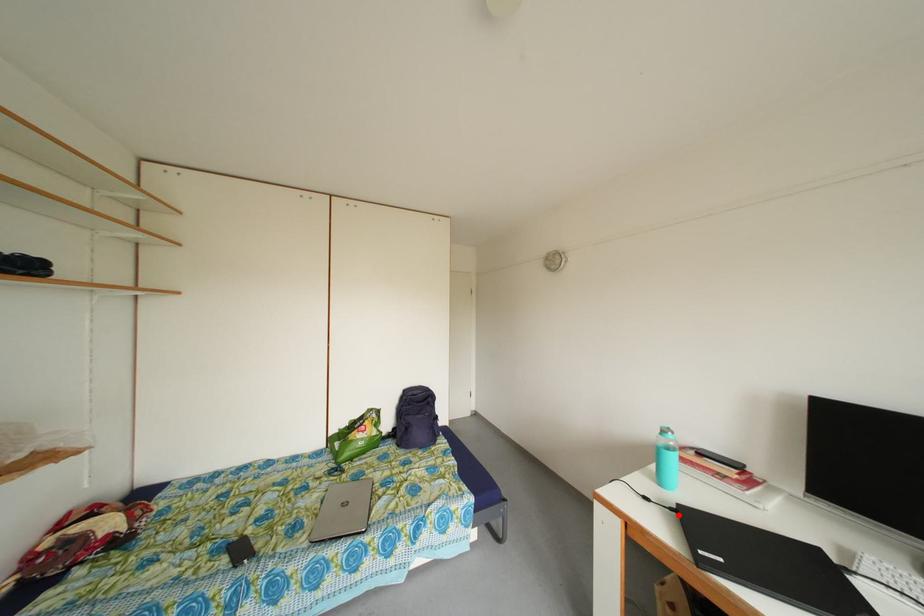
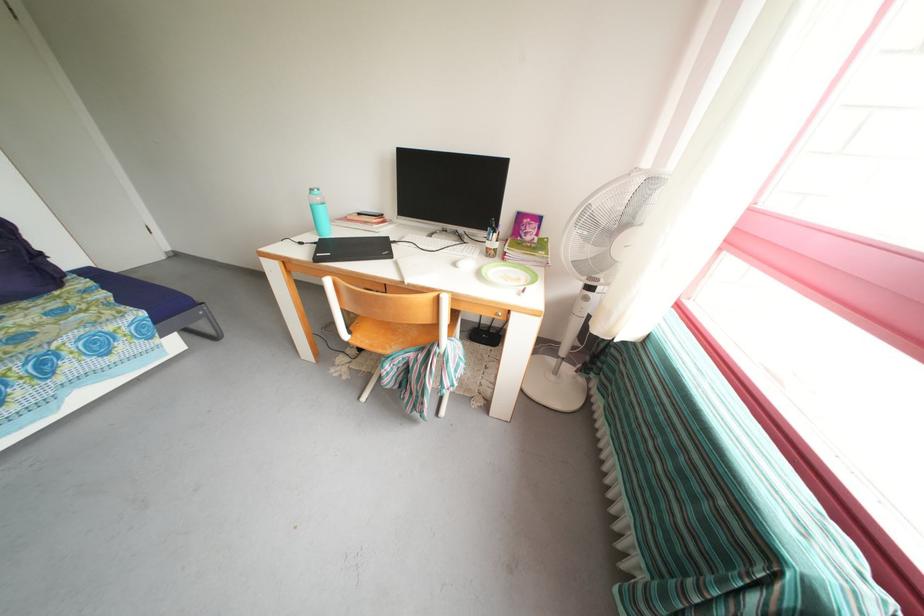
Locate, in the second image, the point that corresponds to the highlighted location in the first image.

(322, 249)